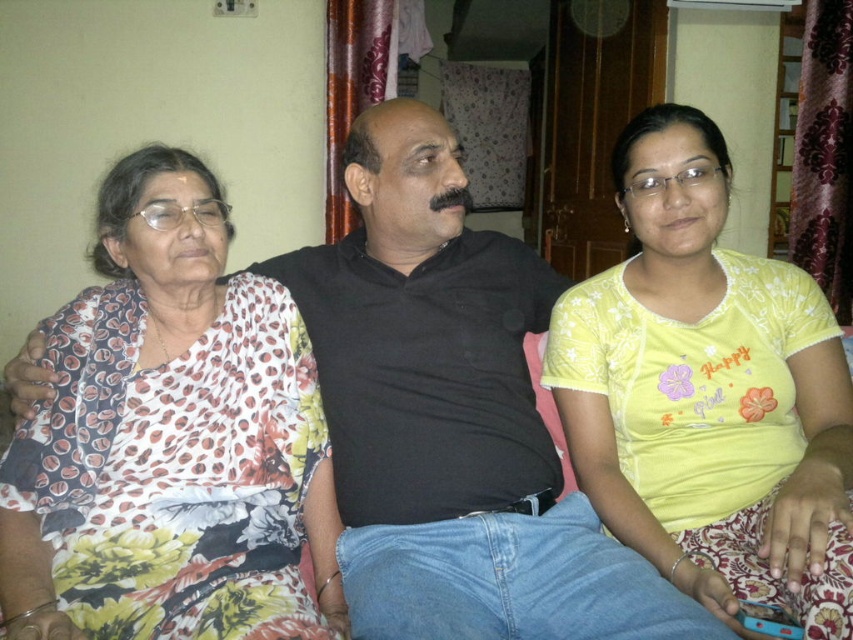
Question: Does yellow printed t-shirt at center have a lesser width compared to floral fabric dress at left?

Choices:
 (A) no
 (B) yes

Answer: (B)

Question: Which point is closer to the camera?

Choices:
 (A) (171, 317)
 (B) (764, 344)

Answer: (A)

Question: Does yellow printed t-shirt at center lie in front of floral fabric dress at left?

Choices:
 (A) no
 (B) yes

Answer: (B)

Question: Which point appears closest to the camera in this image?

Choices:
 (A) (154, 392)
 (B) (708, 552)

Answer: (B)

Question: Does yellow printed t-shirt at center have a greater width compared to floral fabric dress at left?

Choices:
 (A) yes
 (B) no

Answer: (B)